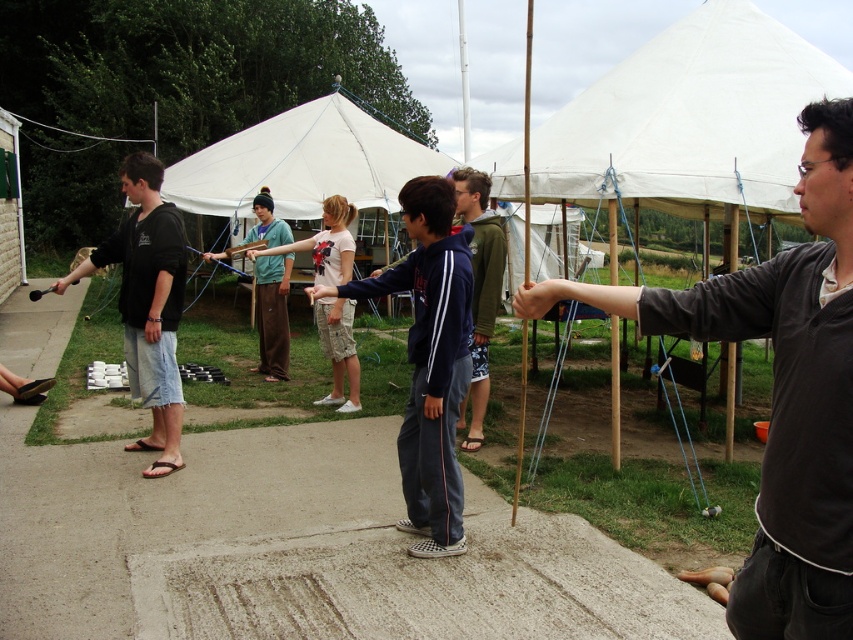
Between white canvas canopy at upper center and brushed metal stick at center, which one is positioned higher?

white canvas canopy at upper center is above.

Locate an element on the screen. white canvas canopy at upper center is located at coordinates (691, 118).

Locate an element on the screen. white canvas canopy at upper center is located at coordinates (691, 118).

Is point (764, 300) positioned after point (502, 284)?

That is False.

Which of these two, dark gray sweater at center or green matte jacket at center, stands shorter?

dark gray sweater at center

Is point (848, 372) less distant than point (476, 340)?

Yes, it is.

You are a GUI agent. You are given a task and a screenshot of the screen. Output one action in this format:
    pyautogui.click(x=<x>, y=<y>)
    Task: Click on the dark gray sweater at center
    The height and width of the screenshot is (640, 853).
    Given the screenshot: What is the action you would take?
    pyautogui.click(x=780, y=390)

Describe the element at coordinates (428, 358) in the screenshot. This screenshot has width=853, height=640. I see `navy blue hoodie at center` at that location.

Is navy blue hoodie at center smaller than brushed metal stick at center?

Actually, navy blue hoodie at center might be larger than brushed metal stick at center.

Is point (432, 438) behind point (254, 288)?

No, (432, 438) is closer to viewer.

This screenshot has height=640, width=853. I want to click on navy blue hoodie at center, so click(428, 358).